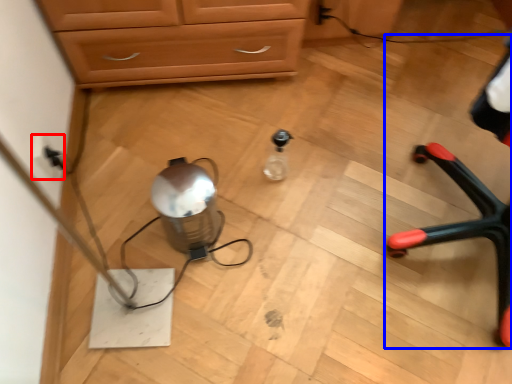
Question: Which of the following is the closest to the observer, electric outlet (highlighted by a red box) or armchair (highlighted by a blue box)?

Choices:
 (A) electric outlet
 (B) armchair

Answer: (B)